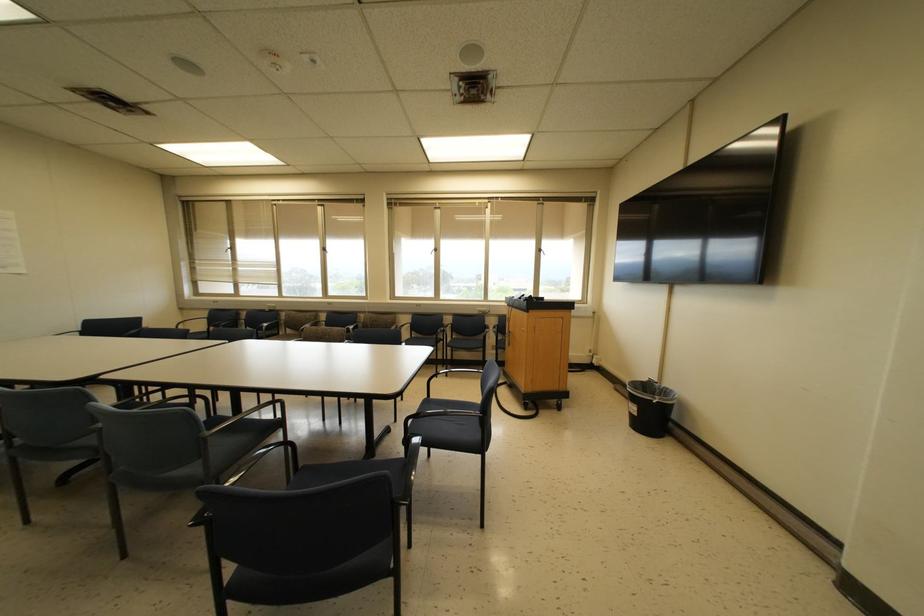
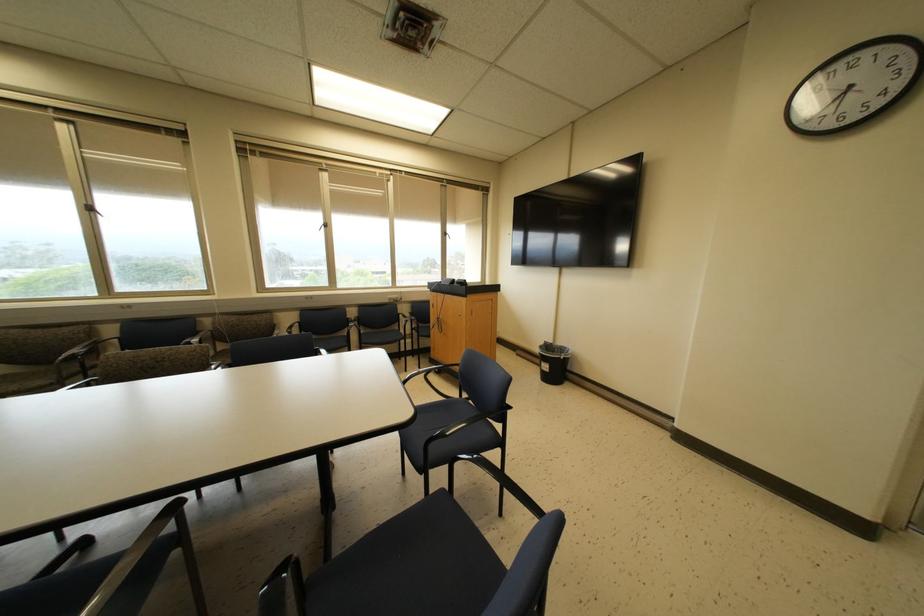
Question: The camera is either moving clockwise (left) or counter-clockwise (right) around the object. The first image is from the beginning of the video and the second image is from the end. Is the camera moving left or right when shooting the video?

Choices:
 (A) Left
 (B) Right

Answer: (A)